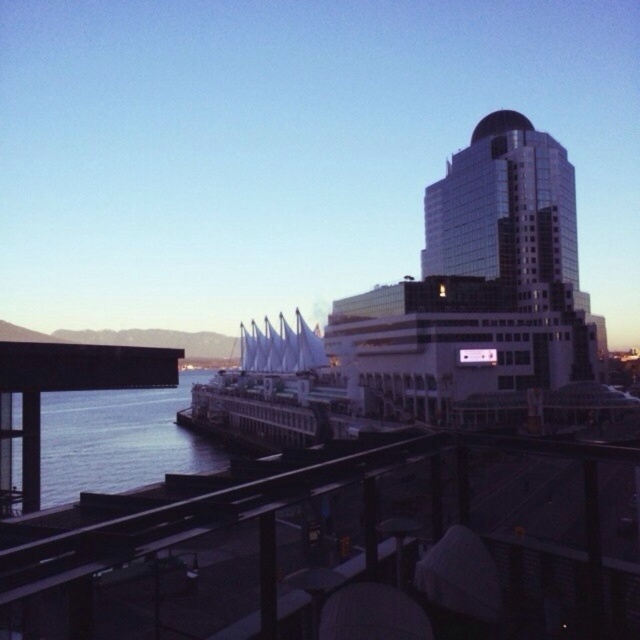
Does glossy glass building at upper right come behind glassy white cruise ship at upper right?

That is True.

Can you confirm if glossy glass building at upper right is shorter than glassy white cruise ship at upper right?

No, glossy glass building at upper right is not shorter than glassy white cruise ship at upper right.

From the picture: Measure the distance between point (246, 0) and camera.

A distance of 245.48 meters exists between point (246, 0) and camera.

You are a GUI agent. You are given a task and a screenshot of the screen. Output one action in this format:
    pyautogui.click(x=<x>, y=<y>)
    Task: Click on the glossy glass building at upper right
    
    Given the screenshot: What is the action you would take?
    pyautogui.click(x=285, y=147)

Is glossy glass building at upper right to the left of metallic rail at lower center from the viewer's perspective?

Correct, you'll find glossy glass building at upper right to the left of metallic rail at lower center.

Is glossy glass building at upper right smaller than metallic rail at lower center?

Incorrect, glossy glass building at upper right is not smaller in size than metallic rail at lower center.

What do you see at coordinates (285, 147) in the screenshot? The image size is (640, 640). I see `glossy glass building at upper right` at bounding box center [285, 147].

Where is `glossy glass building at upper right`? Image resolution: width=640 pixels, height=640 pixels. glossy glass building at upper right is located at coordinates (285, 147).

Can you confirm if glassy white cruise ship at upper right is positioned to the right of metallic rail at lower center?

Indeed, glassy white cruise ship at upper right is positioned on the right side of metallic rail at lower center.

Between point (444, 186) and point (65, 561), which one is positioned in front?

Point (65, 561)

The image size is (640, 640). I want to click on glassy white cruise ship at upper right, so click(x=480, y=284).